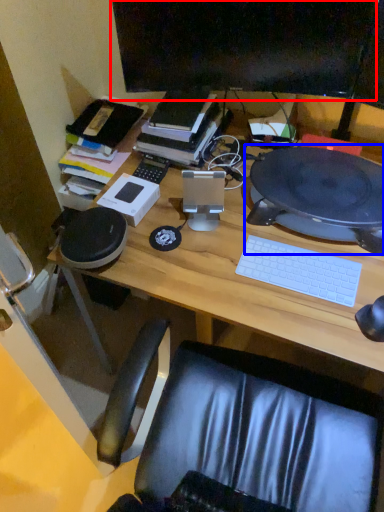
Question: Which object is closer to the camera taking this photo, computer monitor (highlighted by a red box) or computer (highlighted by a blue box)?

Choices:
 (A) computer monitor
 (B) computer

Answer: (B)